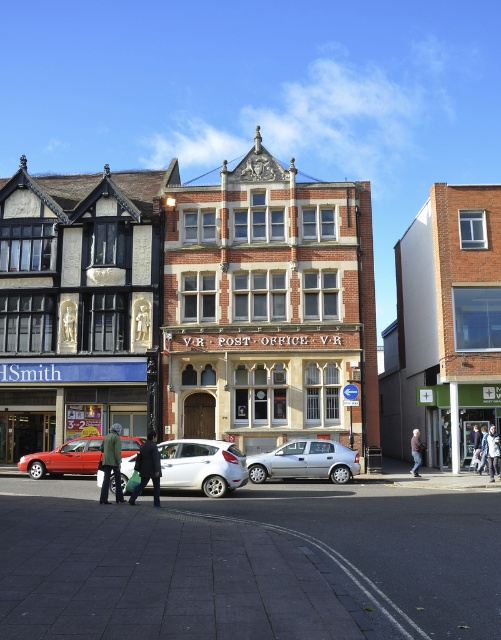
Question: Which point appears farthest from the camera in this image?

Choices:
 (A) (153, 497)
 (B) (472, 433)
 (C) (90, 436)
 (D) (416, 458)

Answer: (B)

Question: Is silver metallic hatchback at center wider than dark blue jeans at center?

Choices:
 (A) no
 (B) yes

Answer: (B)

Question: Among these objects, which one is farthest from the camera?

Choices:
 (A) dark gray fabric jacket at center
 (B) matte red car at center
 (C) light blue jeans at center
 (D) dark green jacket at center

Answer: (B)

Question: In this image, where is matte red car at center located relative to dark green jacket at center?

Choices:
 (A) left
 (B) right

Answer: (B)

Question: Does dark green jacket at center appear on the left side of light blue jeans at center?

Choices:
 (A) yes
 (B) no

Answer: (A)

Question: Estimate the real-world distances between objects in this image. Which object is farther from the dark blue jeans at center?

Choices:
 (A) dark green jacket at center
 (B) matte red car at center
 (C) silver metallic hatchback at center

Answer: (A)